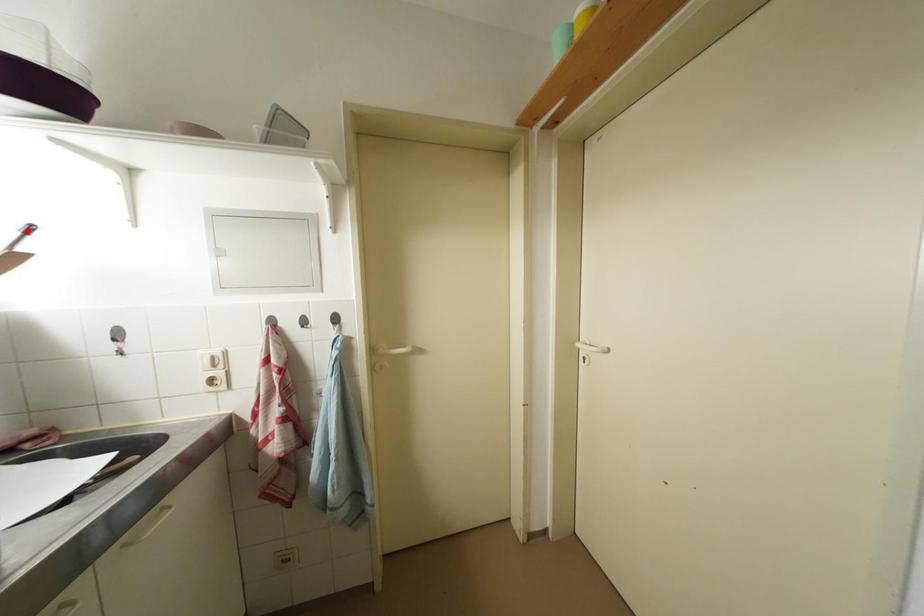
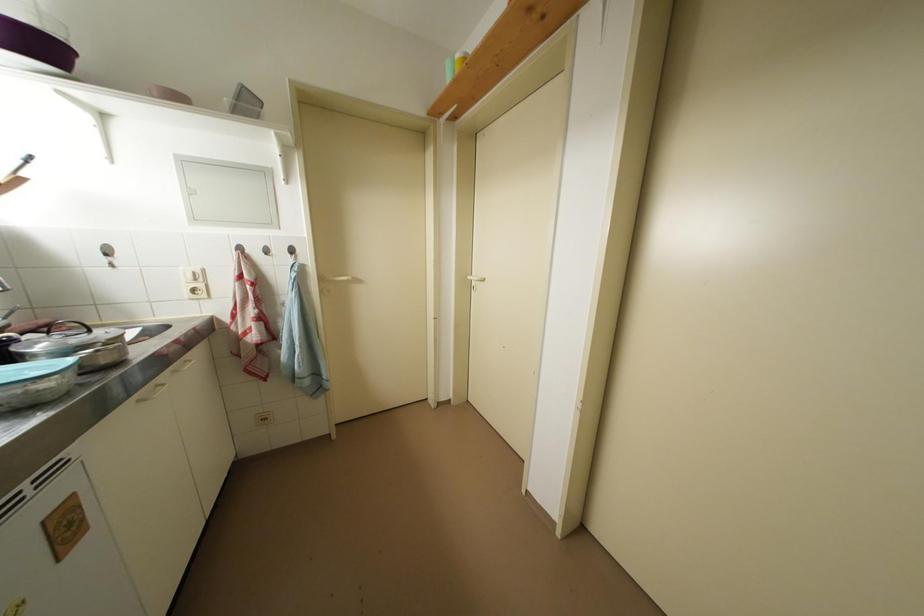
The point at the highlighted location is marked in the first image. Where is the corresponding point in the second image?

(30, 160)